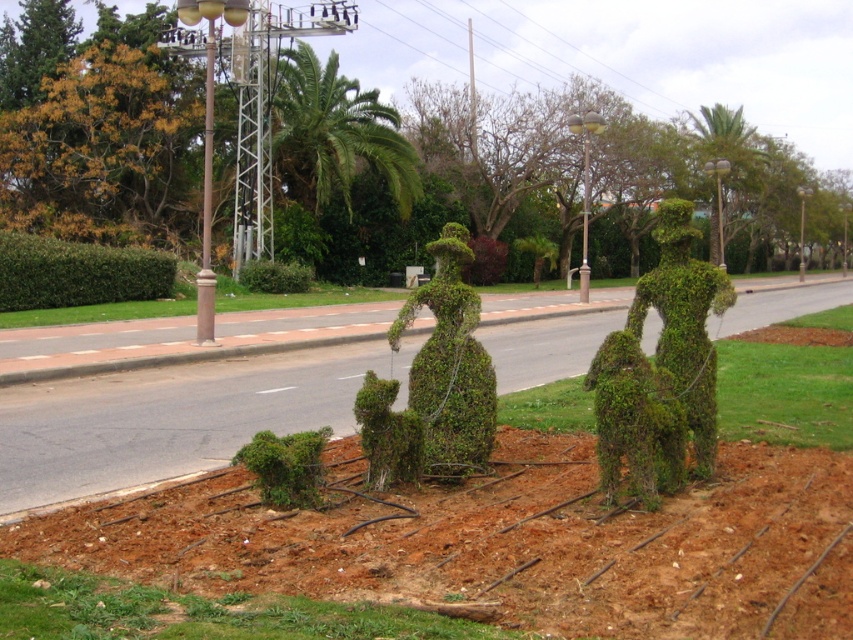
Question: Which point is farther to the camera?

Choices:
 (A) (161, 256)
 (B) (310, 500)
 (C) (405, 614)
 (D) (306, 284)

Answer: (D)

Question: Does green leafy bush at lower left appear over green leafy bush at center?

Choices:
 (A) yes
 (B) no

Answer: (B)

Question: Can you confirm if green grass at lower left is positioned above green leafy bush at lower left?

Choices:
 (A) no
 (B) yes

Answer: (A)

Question: Which is nearer to the green leafy hedge at left?

Choices:
 (A) green leafy bush at lower left
 (B) green grass at lower left
 (C) green leafy bush at center

Answer: (C)

Question: Does green leafy hedge at left appear over green leafy bush at lower left?

Choices:
 (A) yes
 (B) no

Answer: (A)

Question: Which is nearer to the green leafy bush at lower left?

Choices:
 (A) green grass at lower left
 (B) green leafy hedge at left

Answer: (A)